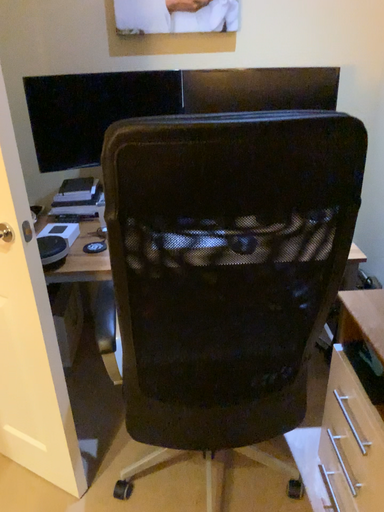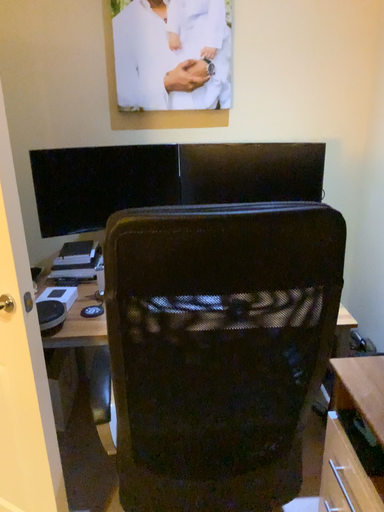
Question: How did the camera likely rotate when shooting the video?

Choices:
 (A) rotated downward
 (B) rotated upward

Answer: (B)